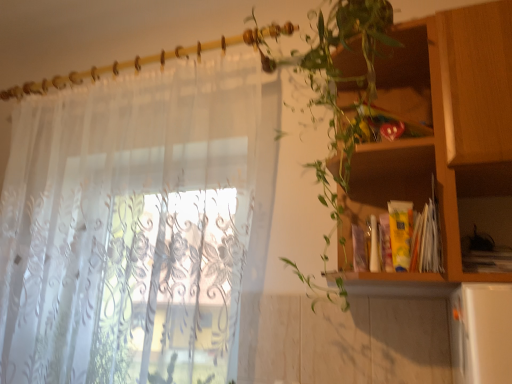
Question: Does wooden cabinet at right have a smaller size compared to green leafy plant at upper right?

Choices:
 (A) yes
 (B) no

Answer: (A)

Question: Can you confirm if wooden cabinet at right is wider than green leafy plant at upper right?

Choices:
 (A) no
 (B) yes

Answer: (A)

Question: From the image's perspective, is wooden cabinet at right on top of green leafy plant at upper right?

Choices:
 (A) yes
 (B) no

Answer: (B)

Question: Is wooden cabinet at right facing away from green leafy plant at upper right?

Choices:
 (A) no
 (B) yes

Answer: (A)

Question: Considering the relative sizes of wooden cabinet at right and green leafy plant at upper right in the image provided, is wooden cabinet at right thinner than green leafy plant at upper right?

Choices:
 (A) no
 (B) yes

Answer: (B)

Question: From a real-world perspective, is wooden cabinet at right beneath green leafy plant at upper right?

Choices:
 (A) no
 (B) yes

Answer: (B)

Question: Is green leafy plant at upper right oriented towards wooden cabinet at right?

Choices:
 (A) no
 (B) yes

Answer: (A)

Question: Is green leafy plant at upper right taller than wooden cabinet at right?

Choices:
 (A) yes
 (B) no

Answer: (A)

Question: Is green leafy plant at upper right wider than wooden cabinet at right?

Choices:
 (A) no
 (B) yes

Answer: (B)

Question: Is green leafy plant at upper right at the right side of wooden cabinet at right?

Choices:
 (A) no
 (B) yes

Answer: (A)

Question: Does green leafy plant at upper right come behind wooden cabinet at right?

Choices:
 (A) yes
 (B) no

Answer: (B)

Question: Does green leafy plant at upper right have a smaller size compared to wooden cabinet at right?

Choices:
 (A) yes
 (B) no

Answer: (B)

Question: From a real-world perspective, is wooden cabinet at right positioned over translucent white curtain at left based on gravity?

Choices:
 (A) no
 (B) yes

Answer: (B)